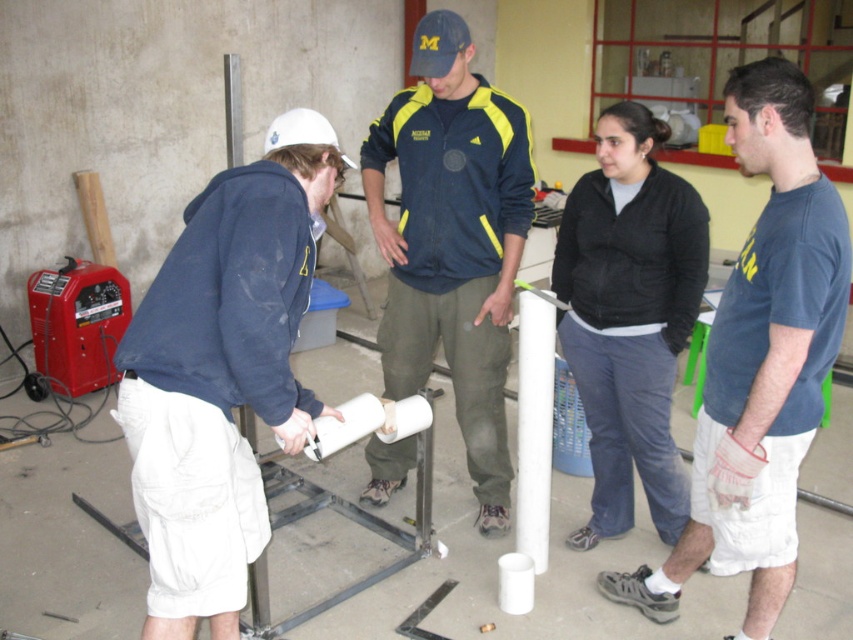
Question: Which is farther from the blue cotton t-shirt at upper right?

Choices:
 (A) blue fabric jacket at center
 (B) white matte hard hat at left
 (C) black cotton shirt at center

Answer: (B)

Question: Does blue fabric jacket at center come behind black cotton shirt at center?

Choices:
 (A) yes
 (B) no

Answer: (A)

Question: Is blue cotton t-shirt at upper right behind black cotton shirt at center?

Choices:
 (A) no
 (B) yes

Answer: (A)

Question: Among these points, which one is nearest to the camera?

Choices:
 (A) (708, 342)
 (B) (676, 241)
 (C) (460, 308)

Answer: (A)

Question: Which point is farther from the camera taking this photo?

Choices:
 (A) (221, 284)
 (B) (592, 180)

Answer: (B)

Question: In this image, where is white matte hard hat at left located relative to blue cotton t-shirt at upper right?

Choices:
 (A) below
 (B) above

Answer: (B)